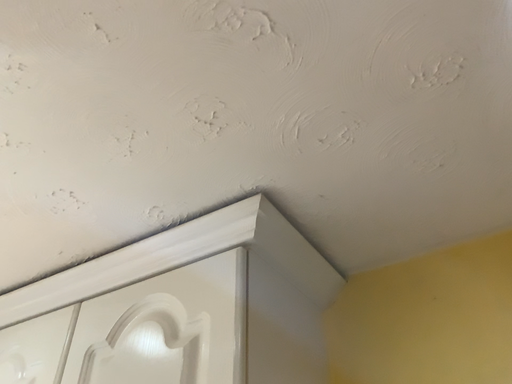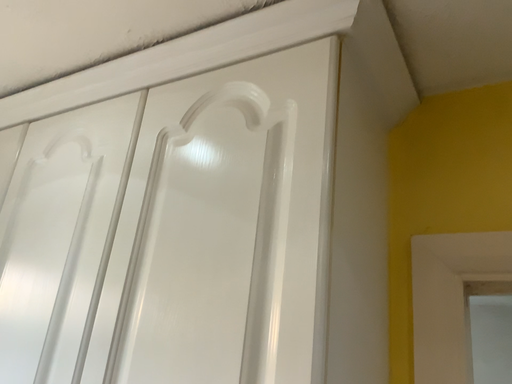
Question: Which way did the camera rotate in the video?

Choices:
 (A) rotated downward
 (B) rotated upward

Answer: (A)